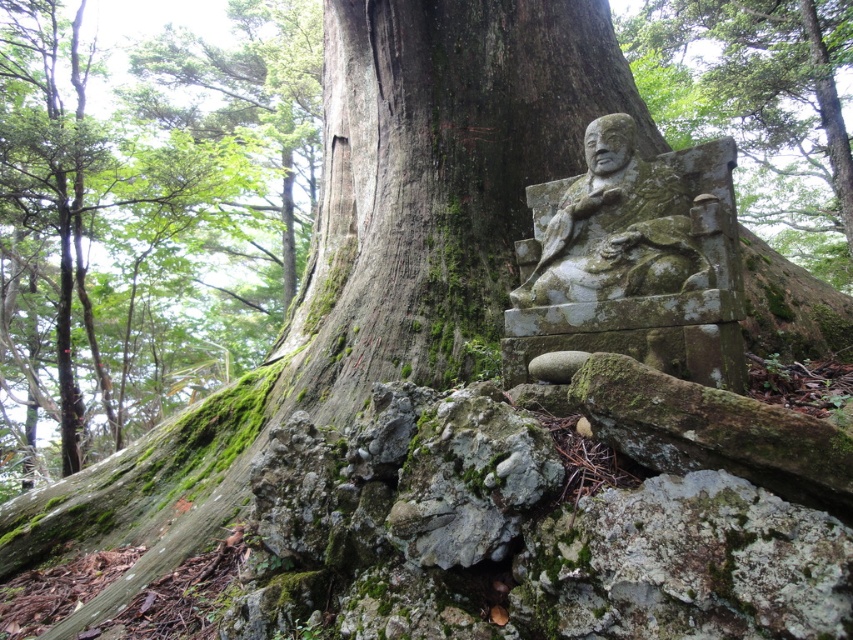
Question: Based on their relative distances, which object is farther from the green mossy stone statue at lower right?

Choices:
 (A) green mossy stone statue at center
 (B) green mossy bark at lower left

Answer: (A)

Question: Which point is closer to the camera taking this photo?

Choices:
 (A) (677, 33)
 (B) (250, 189)

Answer: (B)

Question: Does green mossy stone statue at center have a larger size compared to green mossy stone statue at lower right?

Choices:
 (A) no
 (B) yes

Answer: (A)

Question: Can you confirm if green mossy stone statue at center is smaller than green mossy stone statue at lower right?

Choices:
 (A) yes
 (B) no

Answer: (A)

Question: Does green mossy stone statue at center appear on the right side of green mossy stone statue at lower right?

Choices:
 (A) no
 (B) yes

Answer: (A)

Question: Estimate the real-world distances between objects in this image. Which object is closer to the green mossy stone statue at lower right?

Choices:
 (A) green mossy stone statue at center
 (B) green mossy bark at lower left

Answer: (B)